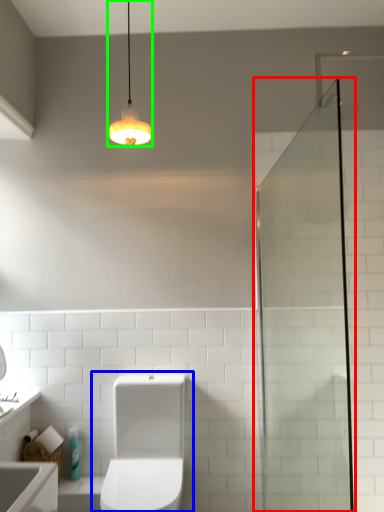
Question: Which is nearer to the screen door (highlighted by a red box)? toilet (highlighted by a blue box) or light fixture (highlighted by a green box).

Choices:
 (A) toilet
 (B) light fixture

Answer: (A)